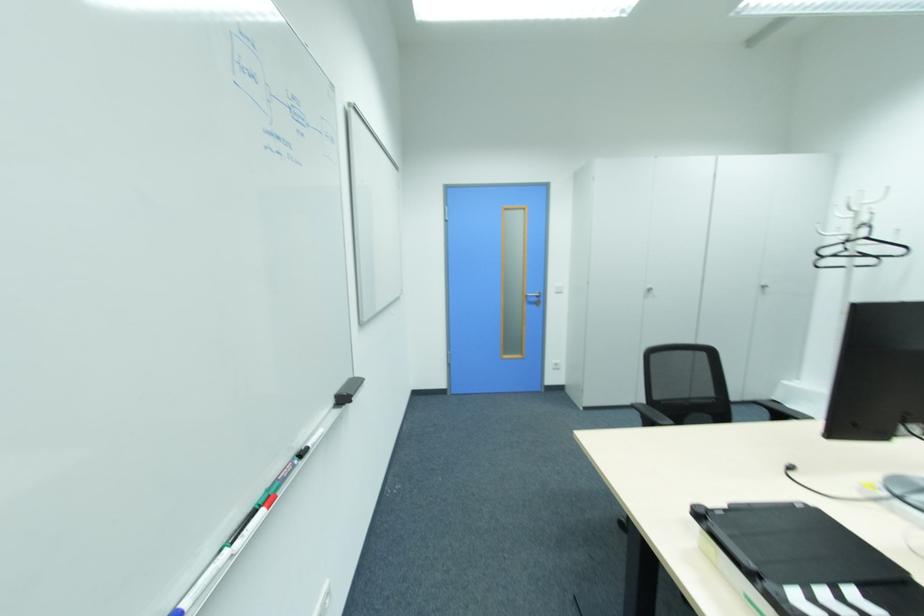
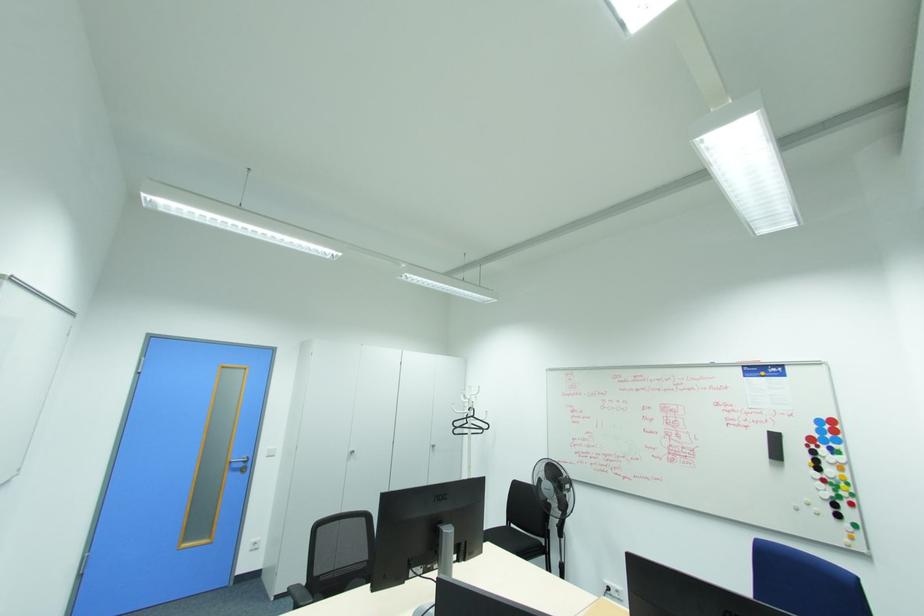
First-person continuous shooting, in which direction is the camera rotating?

The camera rotated toward right-up.